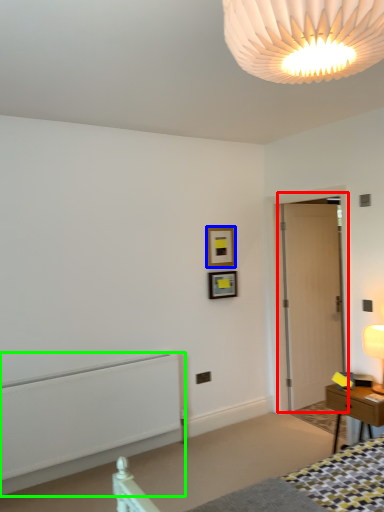
Question: Which object is positioned farthest from door (highlighted by a red box)? Select from picture frame (highlighted by a blue box) and radiator (highlighted by a green box).

Choices:
 (A) picture frame
 (B) radiator

Answer: (B)